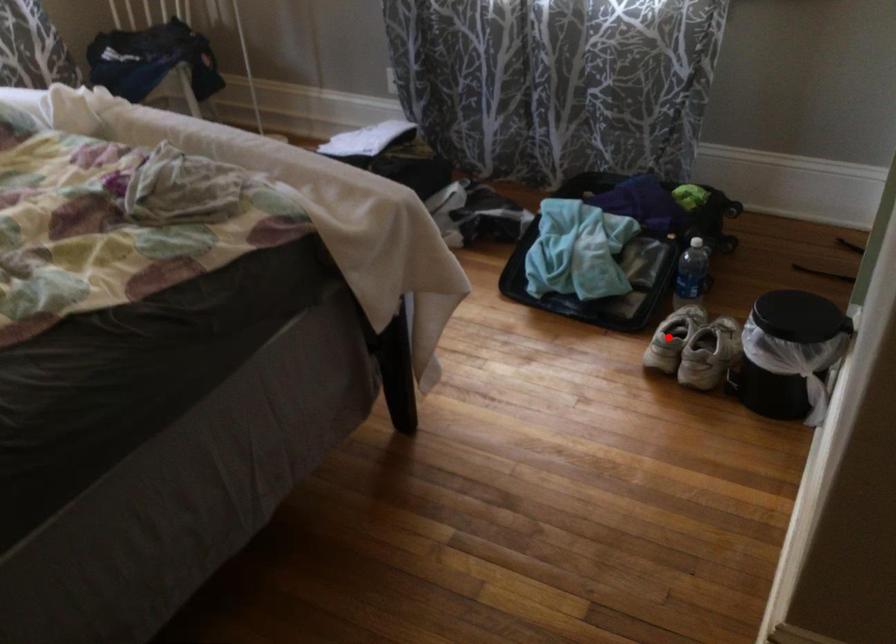
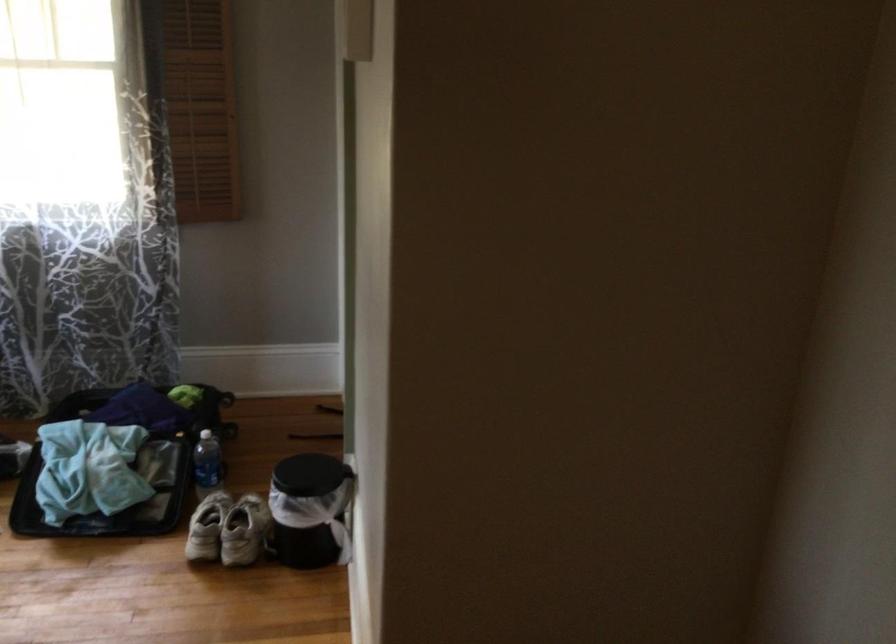
Where in the second image is the point corresponding to the highlighted location from the first image?

(207, 527)